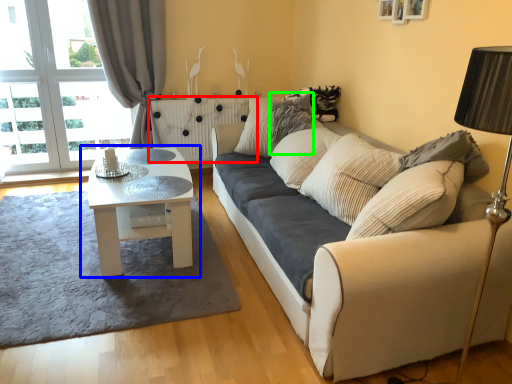
Question: Which object is the farthest from radiator (highlighted by a red box)? Choose among these: coffee table (highlighted by a blue box) or pillow (highlighted by a green box).

Choices:
 (A) coffee table
 (B) pillow

Answer: (A)